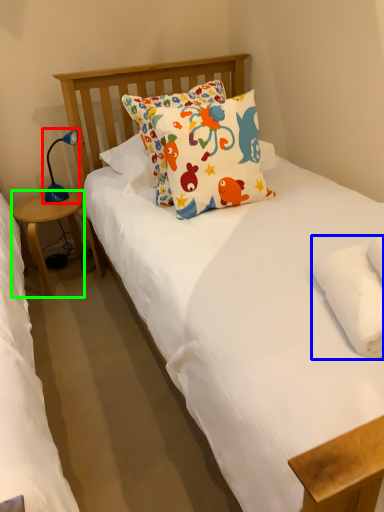
Question: Which is nearer to the table lamp (highlighted by a red box)? pillow (highlighted by a blue box) or table (highlighted by a green box).

Choices:
 (A) pillow
 (B) table

Answer: (B)